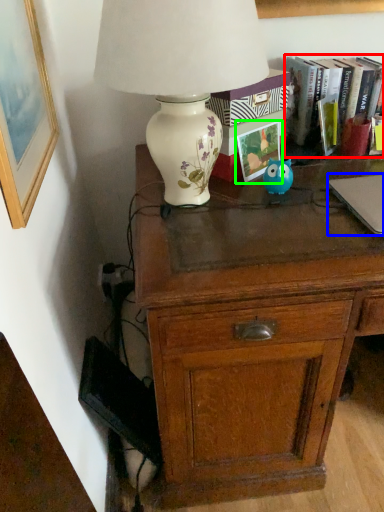
Question: Which object is the farthest from book (highlighted by a red box)? Choose among these: laptop (highlighted by a blue box) or paperback book (highlighted by a green box).

Choices:
 (A) laptop
 (B) paperback book

Answer: (A)